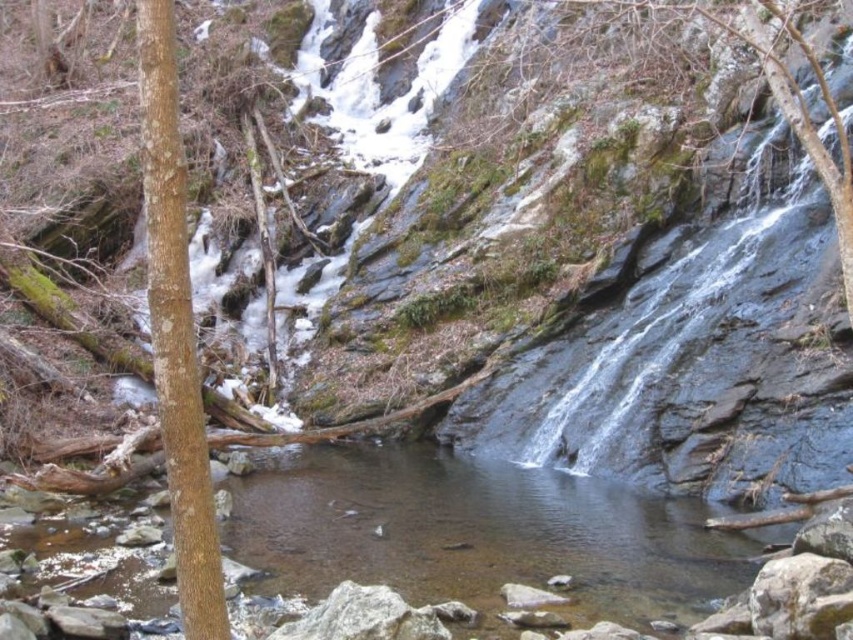
You are a hiker who wants to cross the clear water stream at center. There is a brown rough bark tree at left nearby. Can you use the tree to help cross the stream?

The clear water stream at center is wider than the brown rough bark tree at left, so the tree may not be long enough to serve as a bridge. You might need a longer or sturdier object to safely cross the stream.

You are a hiker who needs to cross the clear water stream at center. There is a brown rough bark tree at left nearby. How far apart are these two landmarks?

The clear water stream at center and the brown rough bark tree at left are 17.02 meters apart.

You are a hiker who wants to cross the clear water stream at center. There is a brown rough bark tree at left nearby. Can you use the tree to help cross the stream?

The clear water stream at center has a larger size compared to brown rough bark tree at left, so the tree may not be large enough to provide stable support for crossing the stream safely.